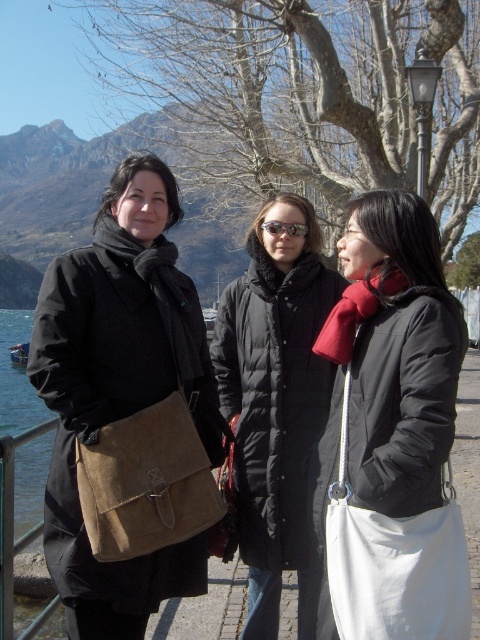
Between point (213, 419) and point (295, 227), which one is positioned in front?

Point (213, 419) is more forward.

At what (x,y) coordinates should I click in order to perform the action: click on matte black coat at left. Please return your answer as a coordinate pair (x, y). The width and height of the screenshot is (480, 640). Looking at the image, I should click on (120, 392).

Identify the location of matte black coat at left. (120, 392).

Can you confirm if blue water at left is shorter than reflective plastic goggles at center?

In fact, blue water at left may be taller than reflective plastic goggles at center.

You are a GUI agent. You are given a task and a screenshot of the screen. Output one action in this format:
    pyautogui.click(x=<x>, y=<y>)
    Task: Click on the blue water at left
    
    Given the screenshot: What is the action you would take?
    pyautogui.click(x=16, y=378)

Is point (276, 275) positioned behind point (25, 456)?

No, it is in front of (25, 456).

Is point (248, 365) in front of point (37, 420)?

That is True.

At what (x,y) coordinates should I click in order to perform the action: click on black puffy coat at center. Please return your answer as a coordinate pair (x, y). The height and width of the screenshot is (640, 480). Looking at the image, I should click on [x=274, y=397].